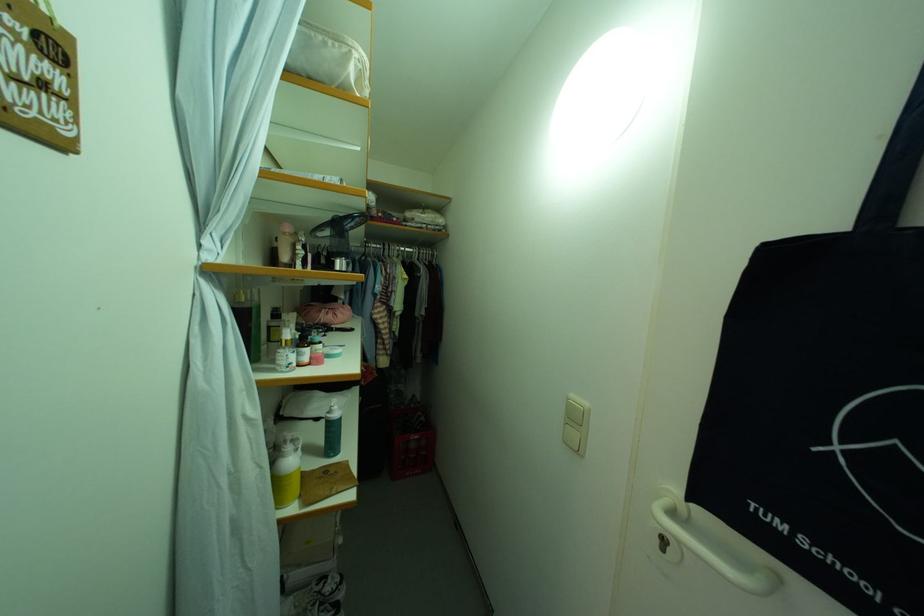
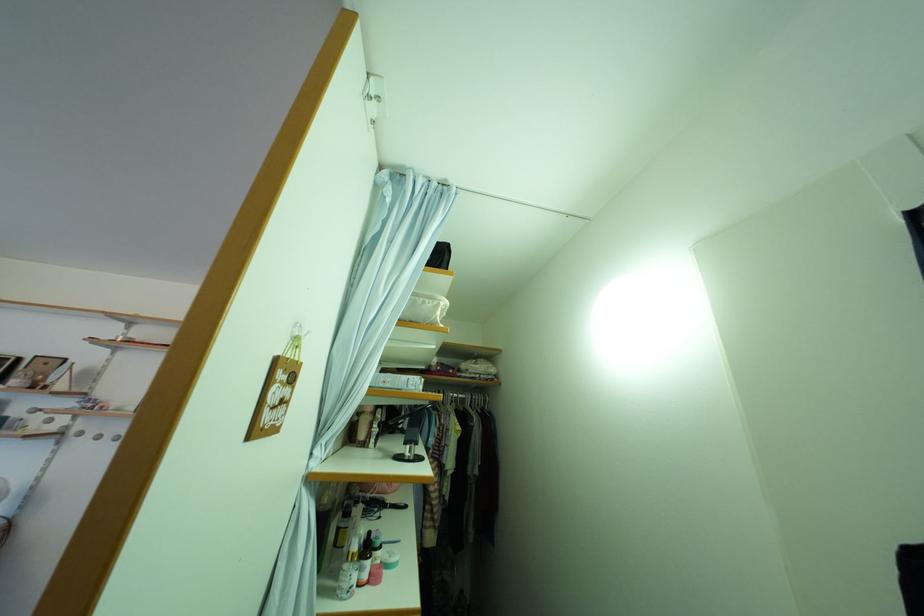
Question: Which direction would the cameraman need to move to produce the second image? Reply with the corresponding letter.

Choices:
 (A) Left
 (B) Right
 (C) Forward
 (D) Backward

Answer: (D)